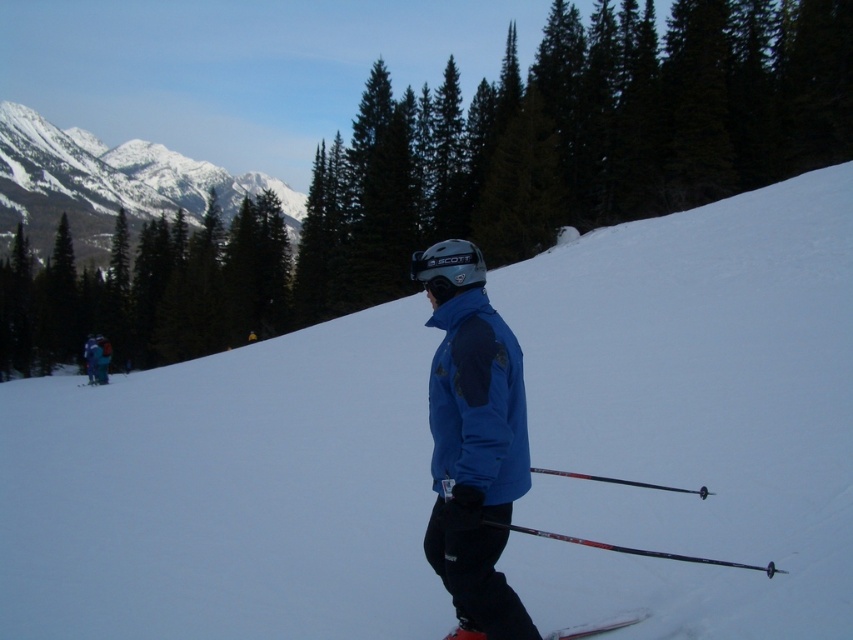
You are a photographer taking a winter landscape photo. You want to ensure that both the green matte tree at upper center and the white plastic ski at lower center are clearly visible in your shot. Which object should you focus on first if you want the one that is taller to be in focus?

The green matte tree at upper center is taller than the white plastic ski at lower center, so you should focus on the green matte tree at upper center first to ensure it is in focus.

You are a photographer trying to capture a shot of the snowy mountain at upper left and the green matte tree at upper center. From your current position, which object is more to the left?

The snowy mountain at upper left is more to the left because the green matte tree at upper center is positioned on the right side of it.

You are a photographer planning to take a landscape photo of the winter scene. You want to ensure both the green matte tree at upper center and the snowy mountain at upper left are clearly visible. Based on their sizes in the image, which object should you prioritize framing closer to the center of your photo?

The snowy mountain at upper left should be prioritized closer to the center because it occupies more space than the green matte tree at upper center, making it a more dominant feature in the composition.